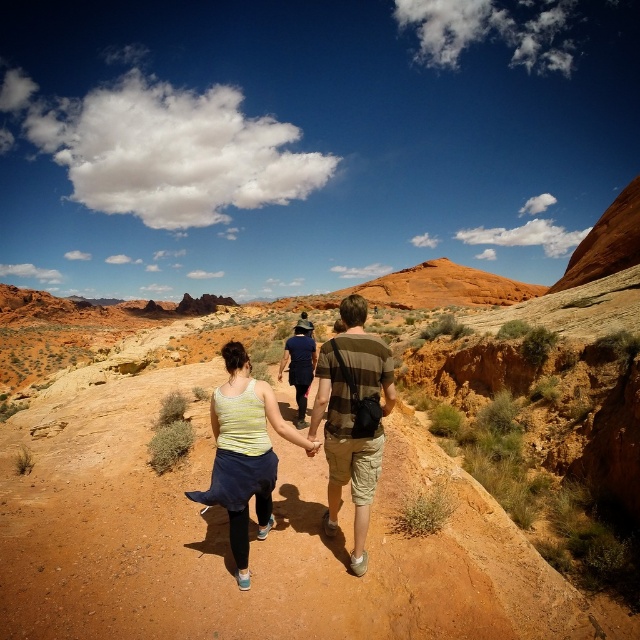
Question: Is camouflage shorts at center to the left of striped cotton shirt at center from the viewer's perspective?

Choices:
 (A) yes
 (B) no

Answer: (B)

Question: Among these objects, which one is farthest from the camera?

Choices:
 (A) yellow-green striped tank top at center
 (B) striped cotton shirt at center

Answer: (B)

Question: Is camouflage shorts at center positioned in front of striped cotton shirt at center?

Choices:
 (A) yes
 (B) no

Answer: (A)

Question: Which point is closer to the camera?

Choices:
 (A) (307, 364)
 (B) (225, 480)

Answer: (B)

Question: Can you confirm if yellow-green striped tank top at center is positioned to the left of striped cotton shirt at center?

Choices:
 (A) yes
 (B) no

Answer: (A)

Question: Which object appears farthest from the camera in this image?

Choices:
 (A) yellow-green striped tank top at center
 (B) striped cotton shirt at center
 (C) camouflage shorts at center

Answer: (B)